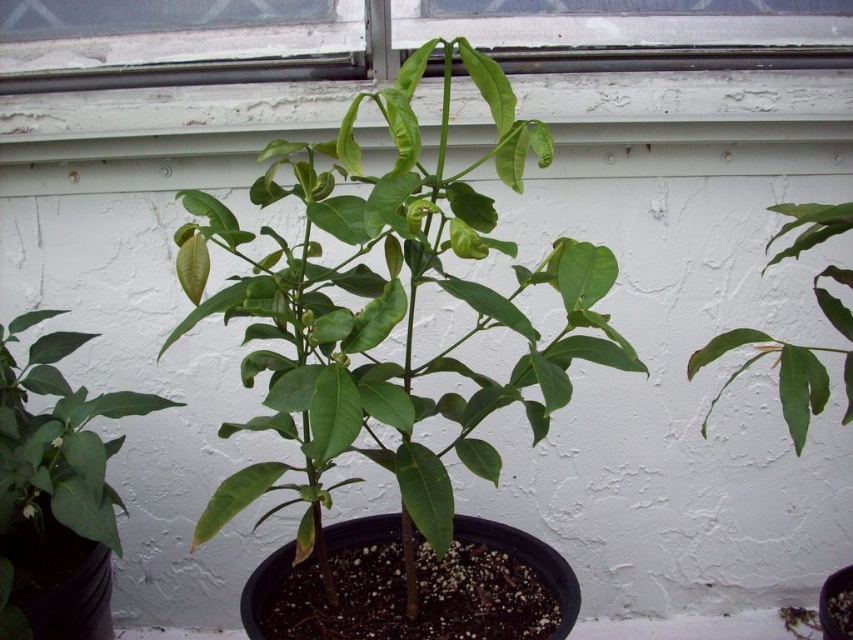
Question: Is green glossy leafy plant at center bigger than green glossy leaf at upper right?

Choices:
 (A) no
 (B) yes

Answer: (B)

Question: Does green glossy leafy plant at center appear on the right side of green glossy leaf at center?

Choices:
 (A) yes
 (B) no

Answer: (A)

Question: Which point is farther to the camera?

Choices:
 (A) (4, 582)
 (B) (495, 157)

Answer: (A)

Question: Which point is farther from the camera taking this photo?

Choices:
 (A) [x=842, y=276]
 (B) [x=33, y=573]

Answer: (B)

Question: Is green glossy leaf at center positioned at the back of green glossy leaf at upper right?

Choices:
 (A) yes
 (B) no

Answer: (A)

Question: Among these points, which one is nearest to the camera?

Choices:
 (A) (437, 502)
 (B) (84, 518)
 (C) (705, 426)

Answer: (A)